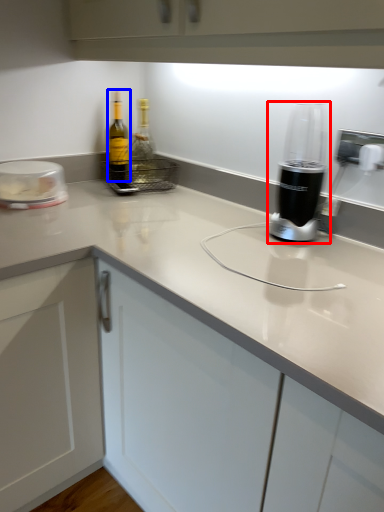
Question: Which object appears closest to the camera in this image, home appliance (highlighted by a red box) or bottle (highlighted by a blue box)?

Choices:
 (A) home appliance
 (B) bottle

Answer: (A)